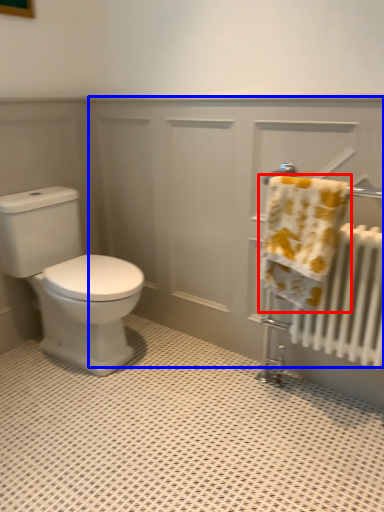
Question: Which of the following is the farthest to the observer, towel (highlighted by a red box) or screen door (highlighted by a blue box)?

Choices:
 (A) towel
 (B) screen door

Answer: (B)